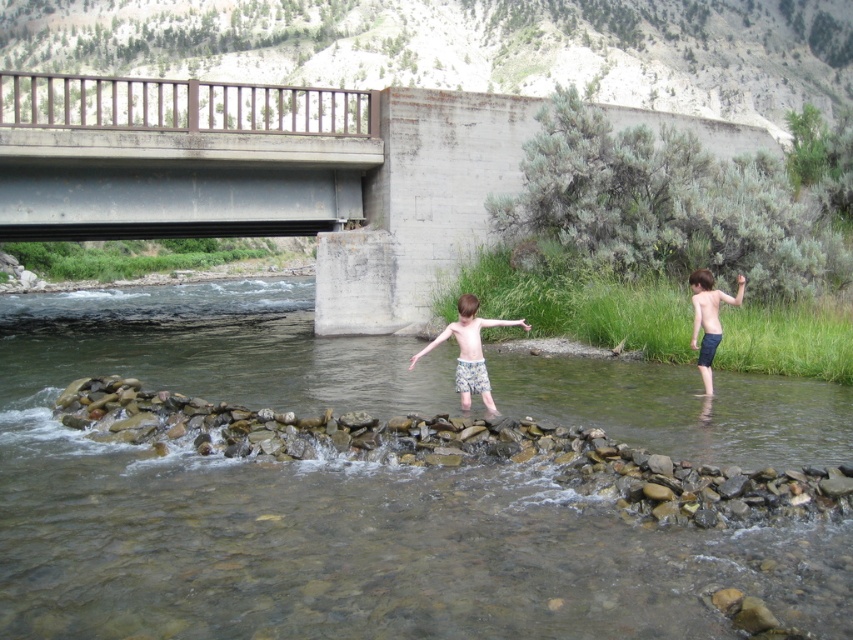
You are standing on the riverbank and want to cross to the other side. The metallic gray bridge at upper center is your only option. However, you notice the light blue shorts at center are in the water below the bridge. Can you safely cross the bridge without getting your clothes wet?

The metallic gray bridge at upper center is to the left of light blue shorts at center, so crossing the bridge would not put you in the water where the light blue shorts at center are located. Therefore, you can safely cross the bridge without getting wet.

You are a drone operator who needs to capture a photo of the metallic gray bridge at upper center and light blue shorts at center. The camera has a minimum focus distance of 15 meters. Can the drone capture both objects in focus at the same time?

The distance between the metallic gray bridge at upper center and light blue shorts at center is 16.97 meters, which is greater than the camera minimum focus distance of 15 meters. Therefore, the drone can capture both objects in focus at the same time.